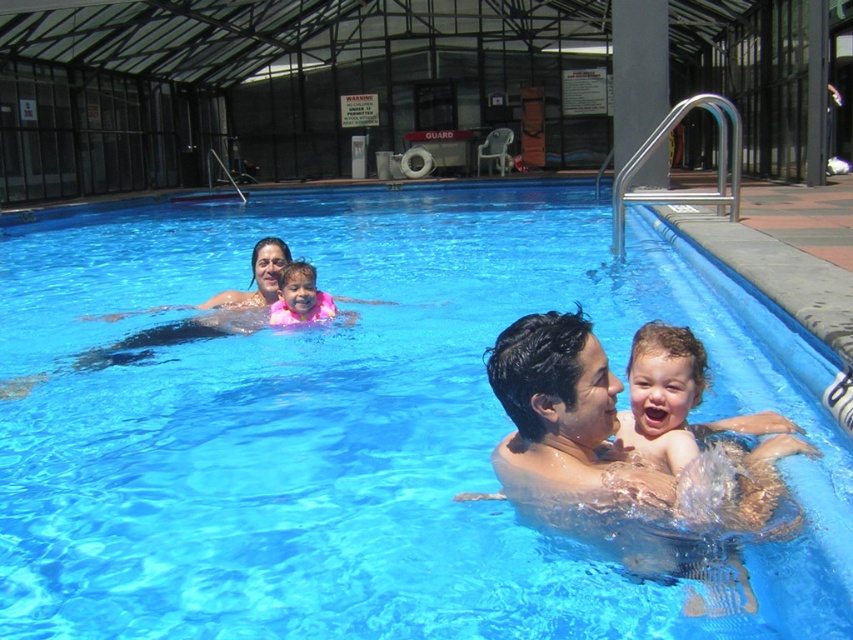
Between point (474, 524) and point (283, 308), which one is positioned in front?

Positioned in front is point (474, 524).

Does transparent blue water at center have a lesser width compared to pink fabric at center?

Incorrect, transparent blue water at center's width is not less than pink fabric at center's.

The width and height of the screenshot is (853, 640). What do you see at coordinates (350, 429) in the screenshot?
I see `transparent blue water at center` at bounding box center [350, 429].

Where is `transparent blue water at center`? This screenshot has width=853, height=640. transparent blue water at center is located at coordinates (350, 429).

Who is higher up, transparent blue water at center or light brown skin at center?

Positioned higher is transparent blue water at center.

Can you confirm if transparent blue water at center is shorter than light brown skin at center?

In fact, transparent blue water at center may be taller than light brown skin at center.

You are a GUI agent. You are given a task and a screenshot of the screen. Output one action in this format:
    pyautogui.click(x=<x>, y=<y>)
    Task: Click on the transparent blue water at center
    This screenshot has height=640, width=853.
    Given the screenshot: What is the action you would take?
    pyautogui.click(x=350, y=429)

Between shiny wet hair at center and pink fabric at center, which one appears on the left side from the viewer's perspective?

From the viewer's perspective, pink fabric at center appears more on the left side.

Is shiny wet hair at center above pink fabric at center?

No, shiny wet hair at center is not above pink fabric at center.

Between point (651, 464) and point (328, 301), which one is positioned behind?

Point (328, 301)

Where is `shiny wet hair at center`? This screenshot has width=853, height=640. shiny wet hair at center is located at coordinates (630, 461).